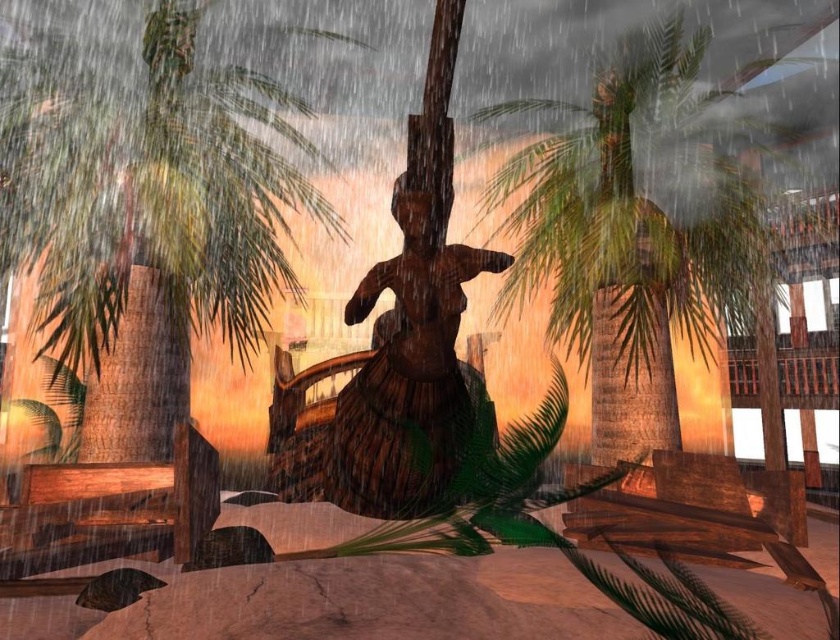
Question: Which object appears closest to the camera in this image?

Choices:
 (A) green leafy palm tree at left
 (B) wooden statue at center
 (C) green leafy palm tree at center

Answer: (B)

Question: Is green leafy palm tree at center thinner than wooden statue at center?

Choices:
 (A) no
 (B) yes

Answer: (B)

Question: Observing the image, what is the correct spatial positioning of green leafy palm tree at left in reference to green leafy palm tree at center?

Choices:
 (A) left
 (B) right

Answer: (A)

Question: Among these objects, which one is nearest to the camera?

Choices:
 (A) green leafy palm tree at left
 (B) wooden statue at center

Answer: (B)

Question: Does green leafy palm tree at left have a lesser width compared to green leafy palm tree at center?

Choices:
 (A) no
 (B) yes

Answer: (A)

Question: Which object is farther from the camera taking this photo?

Choices:
 (A) green leafy palm tree at center
 (B) green leafy palm tree at left

Answer: (B)